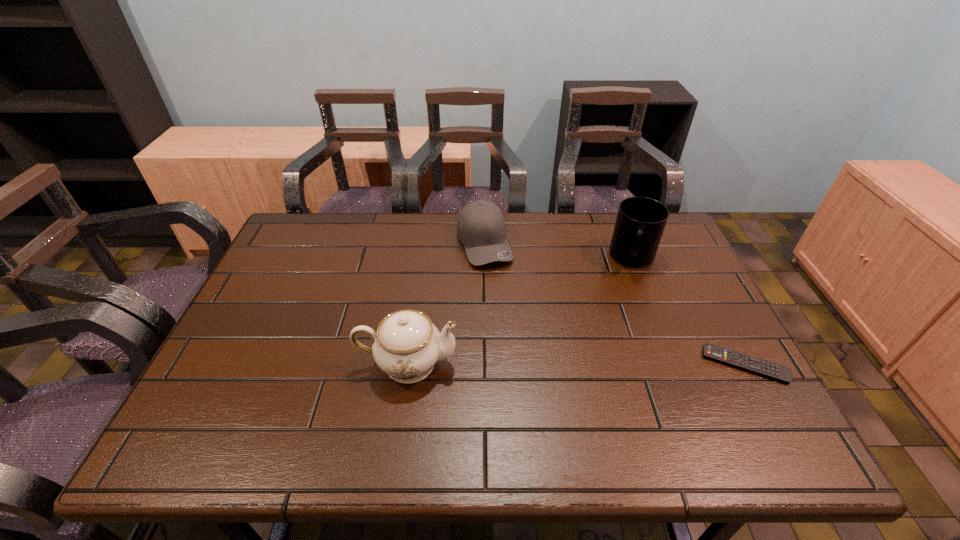
Image resolution: width=960 pixels, height=540 pixels. Find the location of `blank space that satisfies the following two spatial constraints: 1. on the front side of the remote control; 2. on the right side of the second shortest object`. blank space that satisfies the following two spatial constraints: 1. on the front side of the remote control; 2. on the right side of the second shortest object is located at coordinates (486, 364).

Locate an element on the screen. This screenshot has width=960, height=540. free space that satisfies the following two spatial constraints: 1. on the front side of the mug; 2. on the left side of the shortest object is located at coordinates (675, 364).